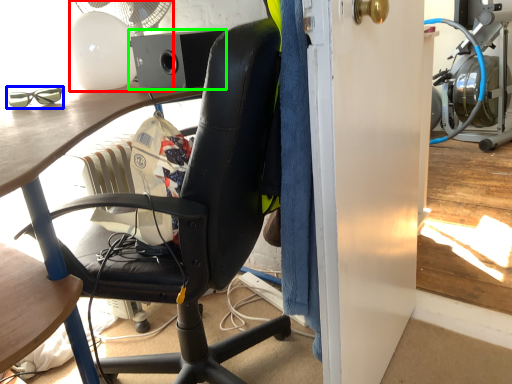
Question: Which object is the closest to the mechanical fan (highlighted by a red box)? Choose among these: glasses (highlighted by a blue box) or loudspeaker (highlighted by a green box).

Choices:
 (A) glasses
 (B) loudspeaker

Answer: (B)